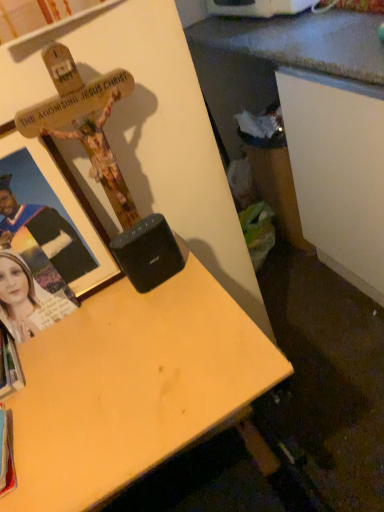
Identify the location of spots to the right of white paper book at lower left. (65, 357).